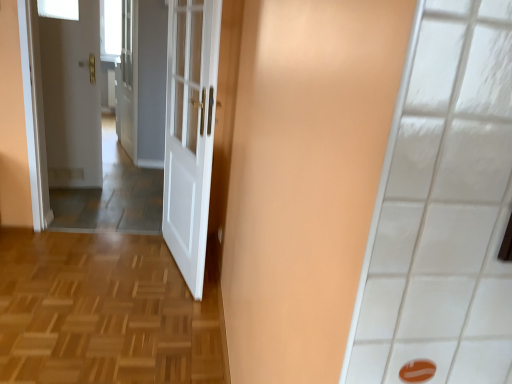
I want to click on white glossy door at center, so click(190, 132).

Measure the distance between point (197,147) and camera.

The depth of point (197,147) is 7.03 feet.

What do you see at coordinates (190, 132) in the screenshot?
I see `white glossy door at center` at bounding box center [190, 132].

Locate an element on the screen. white glossy door at center is located at coordinates (190, 132).